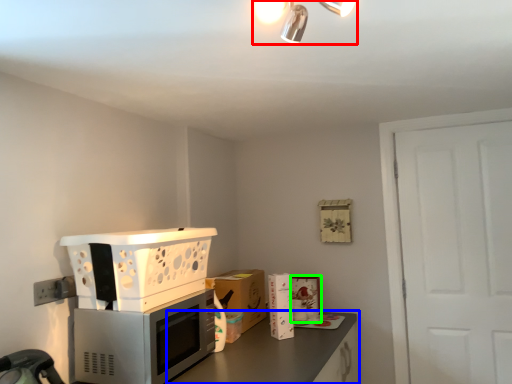
Question: Which is farther away from light fixture (highlighted by a red box)? countertop (highlighted by a blue box) or appliance (highlighted by a green box)?

Choices:
 (A) countertop
 (B) appliance

Answer: (B)